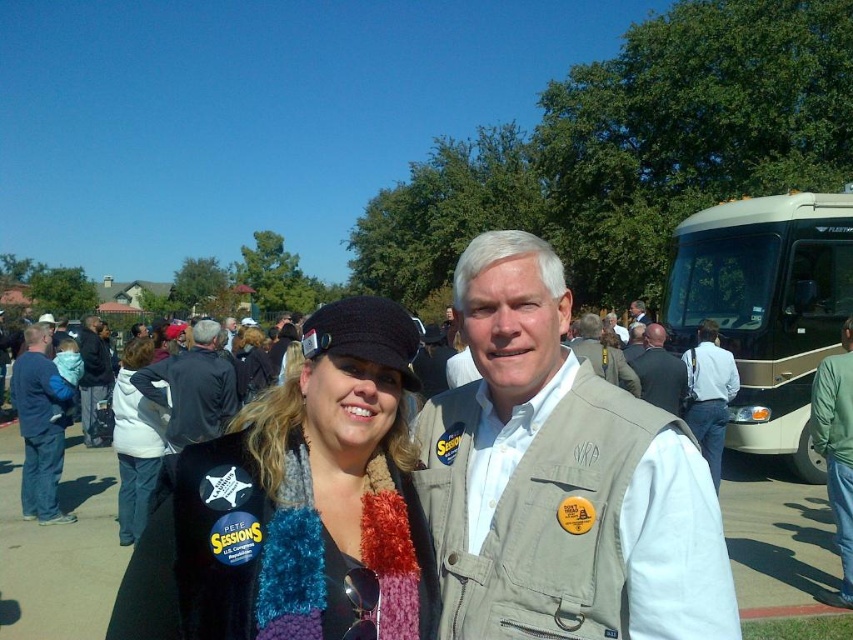
You are a photographer at the event and want to capture a closeup of the knitted scarf at center without including the campaign buttons. Is the scarf positioned in a way that allows this?

The knitted scarf at center is located at point (310, 493), which means it can be framed in the shot to exclude the campaign buttons if the camera is focused precisely on its coordinates.

You are a photographer at the event and want to capture a photo that includes both the white fleece jacket at lower left and the beige vest at center. Based on their positions, which object should you adjust your camera angle to focus on first to ensure both are in frame?

The white fleece jacket at lower left is to the left of the beige vest at center. To capture both in the frame, adjust your camera angle to focus on the white fleece jacket at lower left first since it is positioned further left, ensuring the beige vest at center remains within the right side of the frame.

You are a photographer at the event and want to capture a photo that includes both the knitted scarf at center and the dark blue jeans at lower left. Based on their positions, which object should appear on the right side of the photo?

The knitted scarf at center should appear on the right side of the photo because it is to the right of the dark blue jeans at lower left.